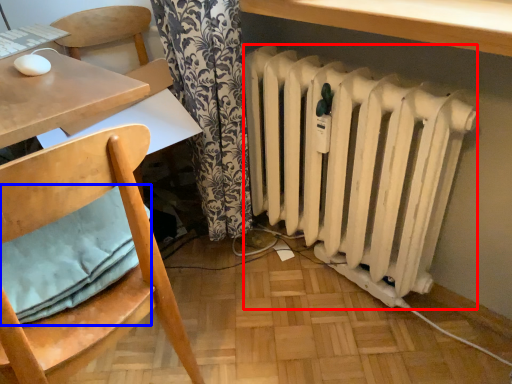
Question: Which object appears closest to the camera in this image, radiator (highlighted by a red box) or pillow (highlighted by a blue box)?

Choices:
 (A) radiator
 (B) pillow

Answer: (B)